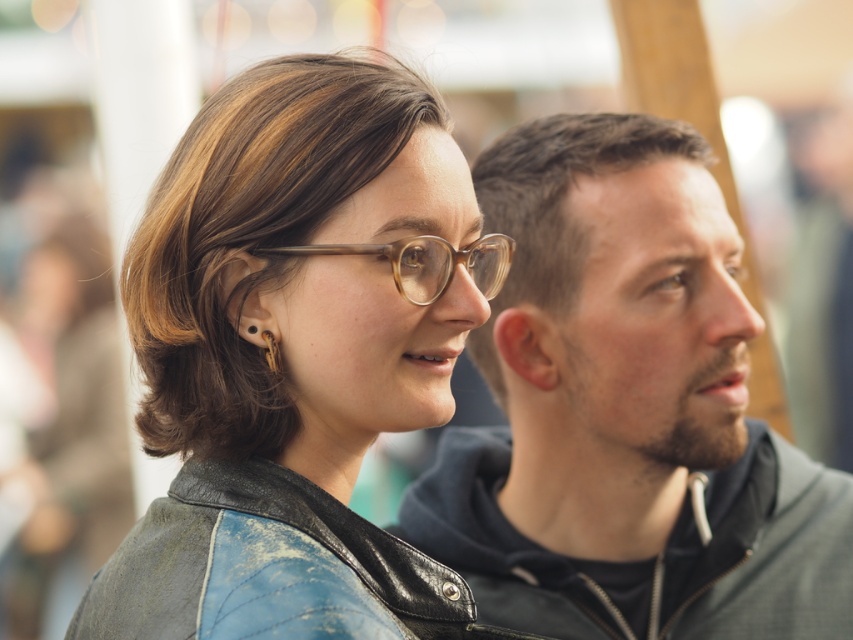
Does leather jacket at upper left have a greater width compared to matte gray hoodie at center?

In fact, leather jacket at upper left might be narrower than matte gray hoodie at center.

This screenshot has width=853, height=640. What do you see at coordinates (294, 355) in the screenshot? I see `leather jacket at upper left` at bounding box center [294, 355].

Where is `leather jacket at upper left`? The height and width of the screenshot is (640, 853). leather jacket at upper left is located at coordinates (294, 355).

Which of these two, leather jacket at upper left or translucent amber eyeglasses at center, stands shorter?

With less height is translucent amber eyeglasses at center.

Does leather jacket at upper left appear over translucent amber eyeglasses at center?

Incorrect, leather jacket at upper left is not positioned above translucent amber eyeglasses at center.

Is point (352, 621) positioned before point (488, 298)?

Yes, point (352, 621) is closer to viewer.

You are a GUI agent. You are given a task and a screenshot of the screen. Output one action in this format:
    pyautogui.click(x=<x>, y=<y>)
    Task: Click on the leather jacket at upper left
    This screenshot has width=853, height=640.
    Given the screenshot: What is the action you would take?
    pyautogui.click(x=294, y=355)

Is matte gray hoodie at center to the left of translucent amber eyeglasses at center from the viewer's perspective?

Incorrect, matte gray hoodie at center is not on the left side of translucent amber eyeglasses at center.

Can you confirm if matte gray hoodie at center is thinner than translucent amber eyeglasses at center?

In fact, matte gray hoodie at center might be wider than translucent amber eyeglasses at center.

Is point (558, 561) positioned after point (473, 268)?

Yes, point (558, 561) is behind point (473, 268).

The image size is (853, 640). I want to click on matte gray hoodie at center, so click(x=625, y=410).